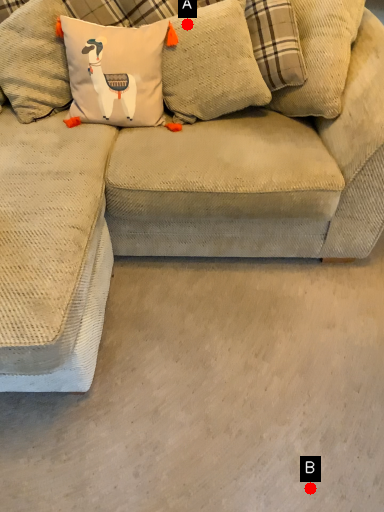
Question: Two points are circled on the image, labeled by A and B beside each circle. Which point is closer to the camera taking this photo?

Choices:
 (A) A is closer
 (B) B is closer

Answer: (B)